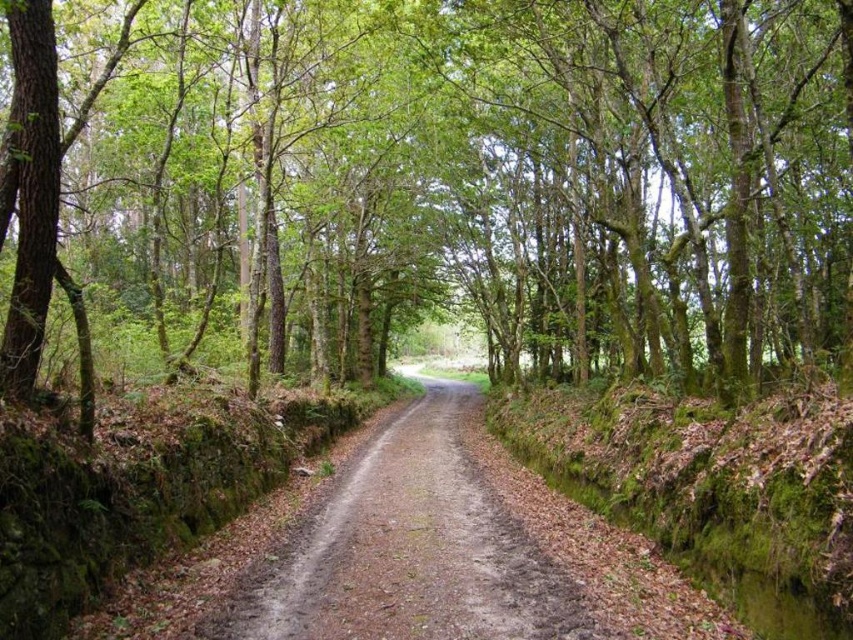
You are a hiker who wants to reach a cabin located 150 feet ahead on the path. You notice a green leafy tree at center in your way. Can you walk around it without deviating from the path?

The green leafy tree at center is 153.32 feet from the viewer, which is beyond the 150 feet distance to the cabin. Therefore, you can continue straight on the path as the tree is slightly past the cabin location and won